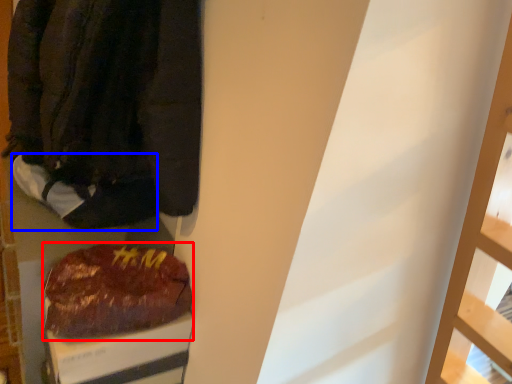
Question: Which object is closer to the camera taking this photo, food (highlighted by a red box) or footwear (highlighted by a blue box)?

Choices:
 (A) food
 (B) footwear

Answer: (A)